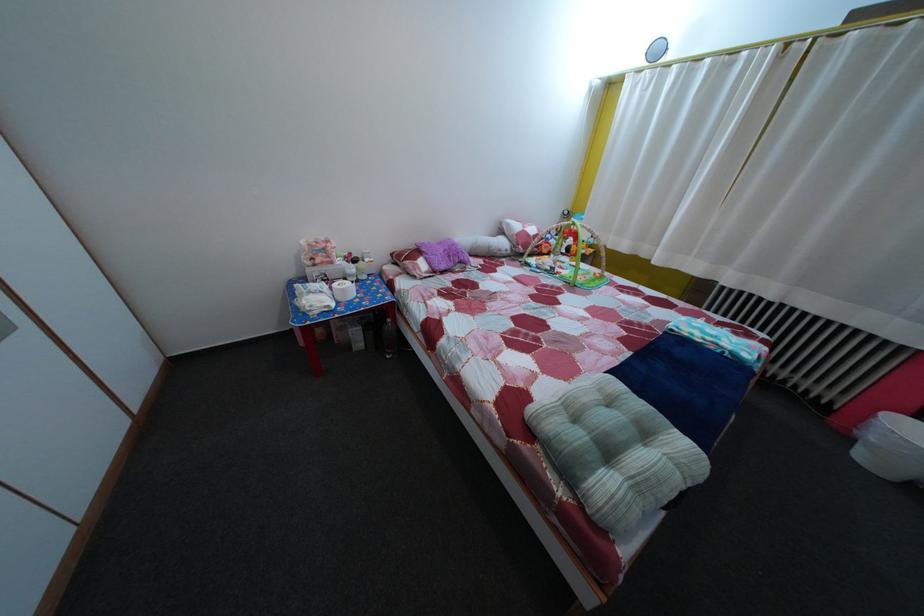
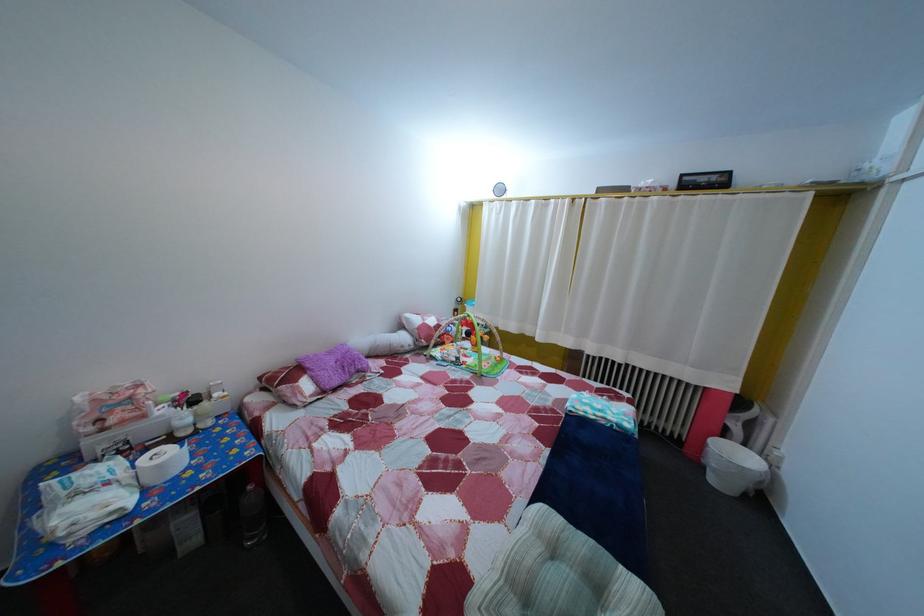
Question: The images are taken continuously from a first-person perspective. In which direction is your viewpoint rotating?

Choices:
 (A) Left
 (B) Right
 (C) Up
 (D) Down

Answer: (B)